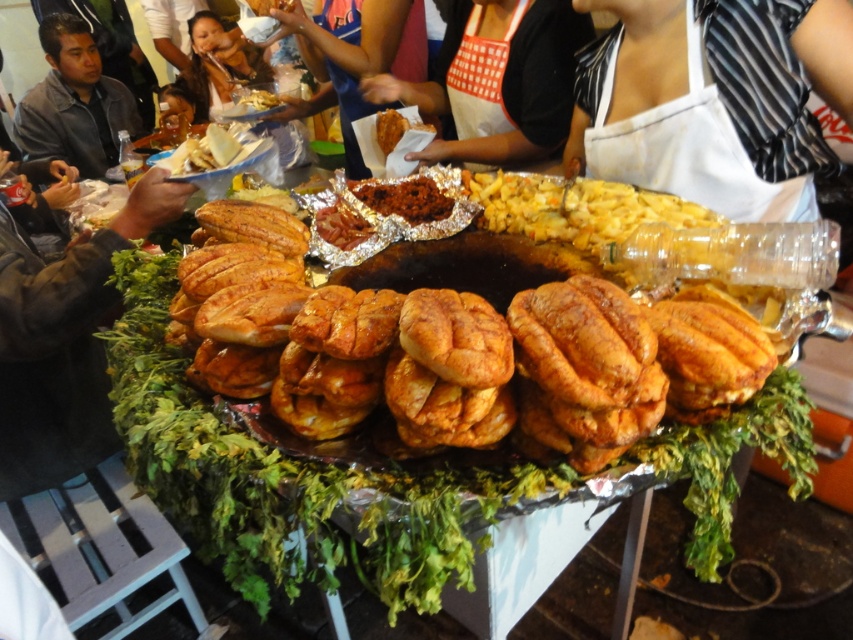
Question: Which of the following is the closest to the observer?

Choices:
 (A) golden crispy bread at center
 (B) dark gray shirt at left

Answer: (A)

Question: Can you confirm if white paper at upper left is positioned above golden crispy chicken at center?

Choices:
 (A) no
 (B) yes

Answer: (A)

Question: Among these objects, which one is nearest to the camera?

Choices:
 (A) brown crumbly meat at center
 (B) golden crispy bread at center
 (C) white apron at center
 (D) white paper at upper left

Answer: (B)

Question: Is dark gray shirt at left bigger than golden crispy chicken at center?

Choices:
 (A) no
 (B) yes

Answer: (B)

Question: Which of the following is the farthest from the observer?

Choices:
 (A) golden crispy bread at center
 (B) white paper at upper left
 (C) dark gray shirt at left

Answer: (C)

Question: Does brown crumbly meat at center come in front of white paper at upper left?

Choices:
 (A) yes
 (B) no

Answer: (A)